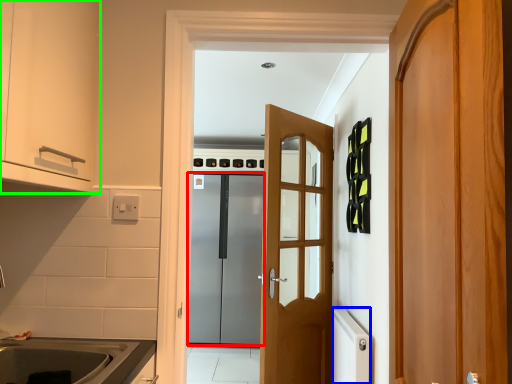
Question: Which object is the closest to the door (highlighted by a red box)? Choose among these: appliance (highlighted by a blue box) or cabinetry (highlighted by a green box).

Choices:
 (A) appliance
 (B) cabinetry

Answer: (A)